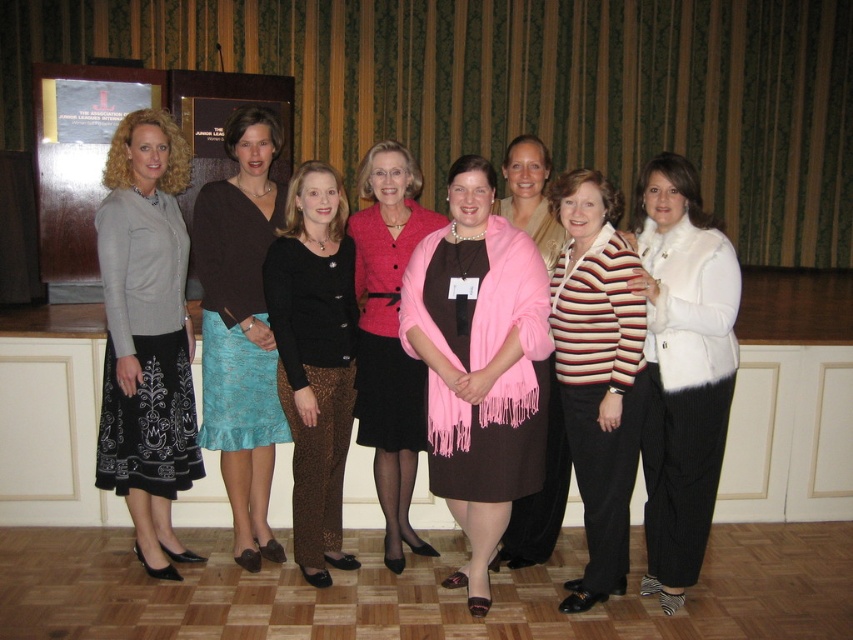
Question: Which point appears closest to the camera in this image?

Choices:
 (A) (502, 257)
 (B) (593, 586)

Answer: (A)

Question: Which object is the farthest from the black lace pants at center?

Choices:
 (A) pink fabric shawl at center
 (B) pink fabric scarf at center

Answer: (B)

Question: From the image, what is the correct spatial relationship of teal satin skirt at center in relation to pink fabric scarf at center?

Choices:
 (A) right
 (B) left

Answer: (B)

Question: Does striped knit sweater at center appear on the right side of pink fabric scarf at center?

Choices:
 (A) yes
 (B) no

Answer: (A)

Question: Is matte black skirt at left to the left of striped knit sweater at center from the viewer's perspective?

Choices:
 (A) yes
 (B) no

Answer: (A)

Question: Based on their relative distances, which object is nearer to the matte pink scarf at center?

Choices:
 (A) black lace pants at center
 (B) striped knit sweater at center
 (C) pink fabric shawl at center
 (D) teal satin skirt at center

Answer: (A)